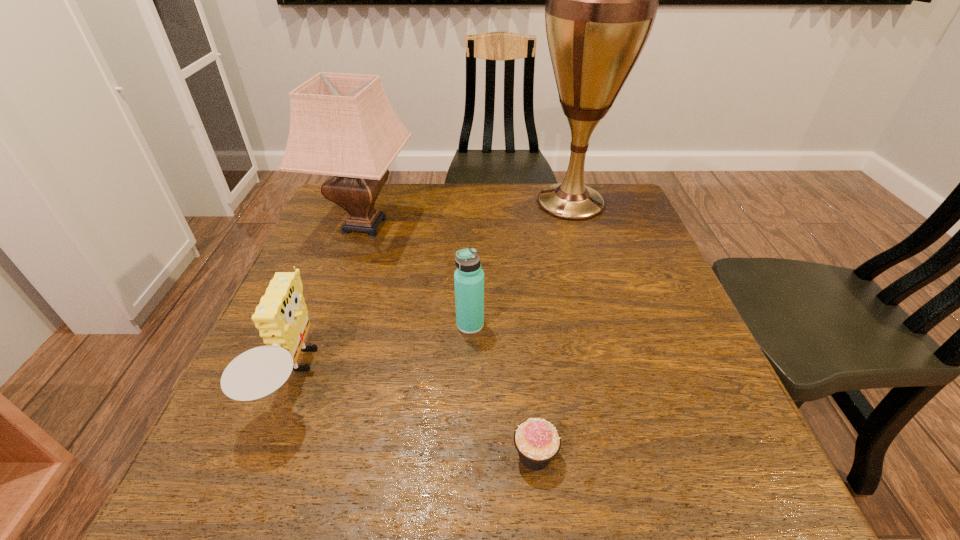
Identify the location of the rightmost object. (601, 2).

Identify the location of the tallest object. point(601,2).

Image resolution: width=960 pixels, height=540 pixels. I want to click on the second tallest object, so click(342, 125).

The height and width of the screenshot is (540, 960). Find the location of `thermos bottle`. thermos bottle is located at coordinates (469, 277).

The image size is (960, 540). I want to click on sponge, so click(281, 317).

Identify the location of the shortest object. (537, 441).

Identify the location of the fourth object from left to right. (537, 441).

This screenshot has height=540, width=960. I want to click on vacant area situated on the left of the rightmost object, so click(x=485, y=202).

Where is `free location located 0.080m on the back of the lampshade`? Image resolution: width=960 pixels, height=540 pixels. free location located 0.080m on the back of the lampshade is located at coordinates (x=378, y=186).

Identify the location of blank area located 0.070m on the back of the thermos bottle. The height and width of the screenshot is (540, 960). (471, 293).